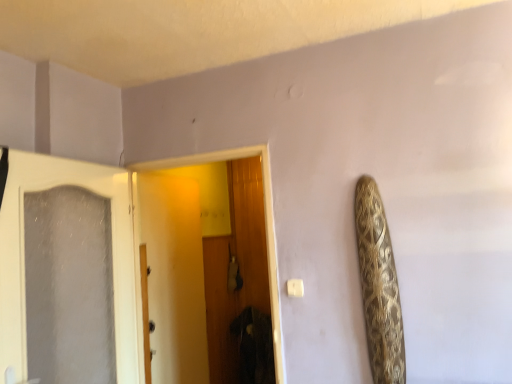
What do you see at coordinates (23, 254) in the screenshot? This screenshot has height=384, width=512. I see `white frosted glass door at left, marked as the first door in a left-to-right arrangement` at bounding box center [23, 254].

Where is `white frosted glass door at left, marked as the first door in a left-to-right arrangement`? This screenshot has width=512, height=384. white frosted glass door at left, marked as the first door in a left-to-right arrangement is located at coordinates (23, 254).

This screenshot has height=384, width=512. I want to click on wooden door at center, positioned as the 1th door in right-to-left order, so click(265, 227).

Describe the element at coordinates (265, 227) in the screenshot. I see `wooden door at center, positioned as the 1th door in right-to-left order` at that location.

Find the location of a particular element. white frosted glass door at left, marked as the first door in a left-to-right arrangement is located at coordinates (23, 254).

In the image, is white frosted glass door at left, arranged as the second door when viewed from the right, on the left side or the right side of wooden door at center, positioned as the 1th door in right-to-left order?

From the image, it's evident that white frosted glass door at left, arranged as the second door when viewed from the right, is to the left of wooden door at center, positioned as the 1th door in right-to-left order.

Is the position of white frosted glass door at left, marked as the first door in a left-to-right arrangement, less distant than that of wooden door at center, which is the second door from left to right?

Yes, white frosted glass door at left, marked as the first door in a left-to-right arrangement, is in front of wooden door at center, which is the second door from left to right.

Is point (126, 243) in front of point (266, 237)?

Yes.

From the image's perspective, which is above, white frosted glass door at left, arranged as the second door when viewed from the right, or wooden door at center, positioned as the 1th door in right-to-left order?

From the image's view, wooden door at center, positioned as the 1th door in right-to-left order, is above.

From a real-world perspective, is white frosted glass door at left, marked as the first door in a left-to-right arrangement, above or below wooden door at center, positioned as the 1th door in right-to-left order?

Clearly, from a real-world perspective, white frosted glass door at left, marked as the first door in a left-to-right arrangement, is above wooden door at center, positioned as the 1th door in right-to-left order.

Based on the photo, considering the sizes of white frosted glass door at left, marked as the first door in a left-to-right arrangement, and wooden door at center, which is the second door from left to right, in the image, is white frosted glass door at left, marked as the first door in a left-to-right arrangement, wider or thinner than wooden door at center, which is the second door from left to right,?

In the image, white frosted glass door at left, marked as the first door in a left-to-right arrangement, appears to be more narrow than wooden door at center, which is the second door from left to right.

Does white frosted glass door at left, arranged as the second door when viewed from the right, have a greater height compared to wooden door at center, which is the second door from left to right?

In fact, white frosted glass door at left, arranged as the second door when viewed from the right, may be shorter than wooden door at center, which is the second door from left to right.

Can you confirm if white frosted glass door at left, marked as the first door in a left-to-right arrangement, is bigger than wooden door at center, positioned as the 1th door in right-to-left order?

Incorrect, white frosted glass door at left, marked as the first door in a left-to-right arrangement, is not larger than wooden door at center, positioned as the 1th door in right-to-left order.

Would you say wooden door at center, positioned as the 1th door in right-to-left order, is part of white frosted glass door at left, arranged as the second door when viewed from the right,'s contents?

No, wooden door at center, positioned as the 1th door in right-to-left order, is located outside of white frosted glass door at left, arranged as the second door when viewed from the right.

Are white frosted glass door at left, marked as the first door in a left-to-right arrangement, and wooden door at center, which is the second door from left to right, far apart?

white frosted glass door at left, marked as the first door in a left-to-right arrangement, is actually quite close to wooden door at center, which is the second door from left to right.

Is white frosted glass door at left, marked as the first door in a left-to-right arrangement, positioned with its back to wooden door at center, which is the second door from left to right?

That's not correct — white frosted glass door at left, marked as the first door in a left-to-right arrangement, is not looking away from wooden door at center, which is the second door from left to right.

At what (x,y) coordinates should I click in order to perform the action: click on door on the right of white frosted glass door at left, marked as the first door in a left-to-right arrangement. Please return your answer as a coordinate pair (x, y). This screenshot has height=384, width=512. Looking at the image, I should click on (265, 227).

Based on their positions, is wooden door at center, positioned as the 1th door in right-to-left order, located to the left or right of white frosted glass door at left, marked as the first door in a left-to-right arrangement?

Clearly, wooden door at center, positioned as the 1th door in right-to-left order, is on the right of white frosted glass door at left, marked as the first door in a left-to-right arrangement, in the image.

Which object is further away from the camera, wooden door at center, which is the second door from left to right, or white frosted glass door at left, marked as the first door in a left-to-right arrangement?

wooden door at center, which is the second door from left to right, is further away from the camera.

Is point (272, 241) closer to viewer compared to point (21, 332)?

No.

From the image's perspective, between wooden door at center, which is the second door from left to right, and white frosted glass door at left, arranged as the second door when viewed from the right, who is located below?

white frosted glass door at left, arranged as the second door when viewed from the right, is shown below in the image.

From a real-world perspective, is wooden door at center, which is the second door from left to right, positioned under white frosted glass door at left, marked as the first door in a left-to-right arrangement, based on gravity?

Yes.

Does wooden door at center, which is the second door from left to right, have a lesser width compared to white frosted glass door at left, marked as the first door in a left-to-right arrangement?

In fact, wooden door at center, which is the second door from left to right, might be wider than white frosted glass door at left, marked as the first door in a left-to-right arrangement.

Can you confirm if wooden door at center, positioned as the 1th door in right-to-left order, is taller than white frosted glass door at left, arranged as the second door when viewed from the right?

Yes, wooden door at center, positioned as the 1th door in right-to-left order, is taller than white frosted glass door at left, arranged as the second door when viewed from the right.

Between wooden door at center, which is the second door from left to right, and white frosted glass door at left, marked as the first door in a left-to-right arrangement, which one has smaller size?

white frosted glass door at left, marked as the first door in a left-to-right arrangement.

Is white frosted glass door at left, marked as the first door in a left-to-right arrangement, a part of wooden door at center, positioned as the 1th door in right-to-left order?

No.

Is wooden door at center, positioned as the 1th door in right-to-left order, not close to white frosted glass door at left, marked as the first door in a left-to-right arrangement?

No.

Could you tell me if wooden door at center, which is the second door from left to right, is facing white frosted glass door at left, arranged as the second door when viewed from the right?

Yes, wooden door at center, which is the second door from left to right, is turned towards white frosted glass door at left, arranged as the second door when viewed from the right.

How distant is wooden door at center, which is the second door from left to right, from white frosted glass door at left, arranged as the second door when viewed from the right?

A distance of 24.84 inches exists between wooden door at center, which is the second door from left to right, and white frosted glass door at left, arranged as the second door when viewed from the right.

Where is `door above the wooden door at center, positioned as the 1th door in right-to-left order (from a real-world perspective)`? Image resolution: width=512 pixels, height=384 pixels. door above the wooden door at center, positioned as the 1th door in right-to-left order (from a real-world perspective) is located at coordinates (23, 254).

Identify the location of door on the left side of wooden door at center, positioned as the 1th door in right-to-left order. This screenshot has height=384, width=512. (23, 254).

The image size is (512, 384). What are the coordinates of `door above the wooden door at center, positioned as the 1th door in right-to-left order (from a real-world perspective)` in the screenshot? It's located at (23, 254).